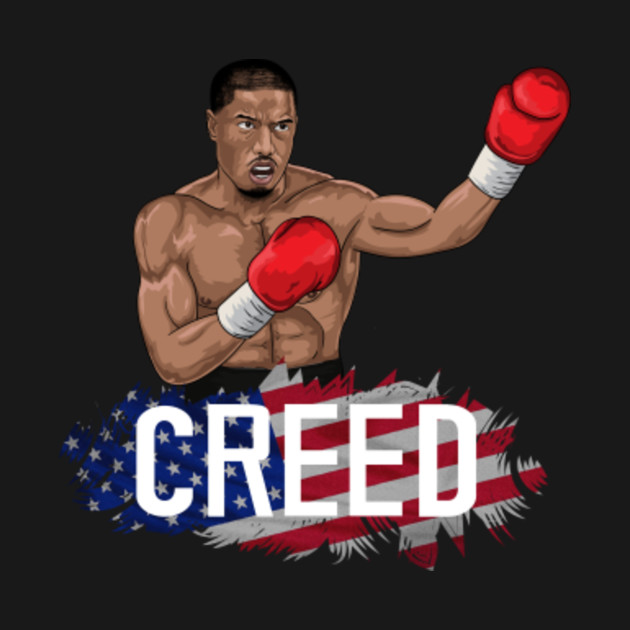
Where is `painting`? The height and width of the screenshot is (630, 630). painting is located at coordinates (309, 289).